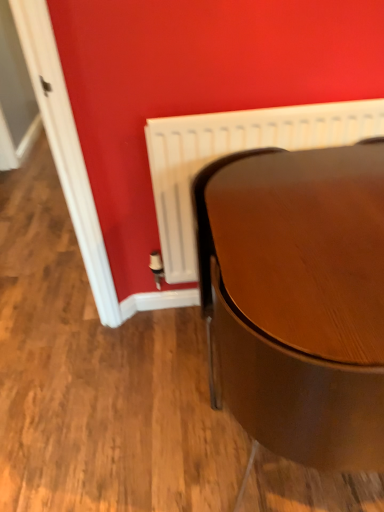
Question: Is glossy wood table at lower right next to white plastic radiator at center?

Choices:
 (A) yes
 (B) no

Answer: (B)

Question: Is white plastic radiator at center surrounded by glossy wood table at lower right?

Choices:
 (A) yes
 (B) no

Answer: (B)

Question: Does glossy wood table at lower right lie in front of white plastic radiator at center?

Choices:
 (A) no
 (B) yes

Answer: (B)

Question: Can you confirm if glossy wood table at lower right is positioned to the right of white plastic radiator at center?

Choices:
 (A) no
 (B) yes

Answer: (B)

Question: Is glossy wood table at lower right oriented away from white plastic radiator at center?

Choices:
 (A) no
 (B) yes

Answer: (B)

Question: Can you confirm if glossy wood table at lower right is taller than white plastic radiator at center?

Choices:
 (A) yes
 (B) no

Answer: (A)

Question: Does white plastic radiator at center have a larger size compared to glossy wood table at lower right?

Choices:
 (A) yes
 (B) no

Answer: (B)

Question: Considering the relative sizes of white plastic radiator at center and glossy wood table at lower right in the image provided, is white plastic radiator at center thinner than glossy wood table at lower right?

Choices:
 (A) yes
 (B) no

Answer: (A)

Question: Is the position of white plastic radiator at center more distant than that of glossy wood table at lower right?

Choices:
 (A) yes
 (B) no

Answer: (A)

Question: Considering the relative sizes of white plastic radiator at center and glossy wood table at lower right in the image provided, is white plastic radiator at center smaller than glossy wood table at lower right?

Choices:
 (A) yes
 (B) no

Answer: (A)

Question: Can you confirm if white plastic radiator at center is positioned to the left of glossy wood table at lower right?

Choices:
 (A) yes
 (B) no

Answer: (A)

Question: Is white plastic radiator at center outside of glossy wood table at lower right?

Choices:
 (A) yes
 (B) no

Answer: (A)

Question: Considering the relative positions of white plastic radiator at center and glossy wood table at lower right in the image provided, is white plastic radiator at center to the left or to the right of glossy wood table at lower right?

Choices:
 (A) left
 (B) right

Answer: (A)